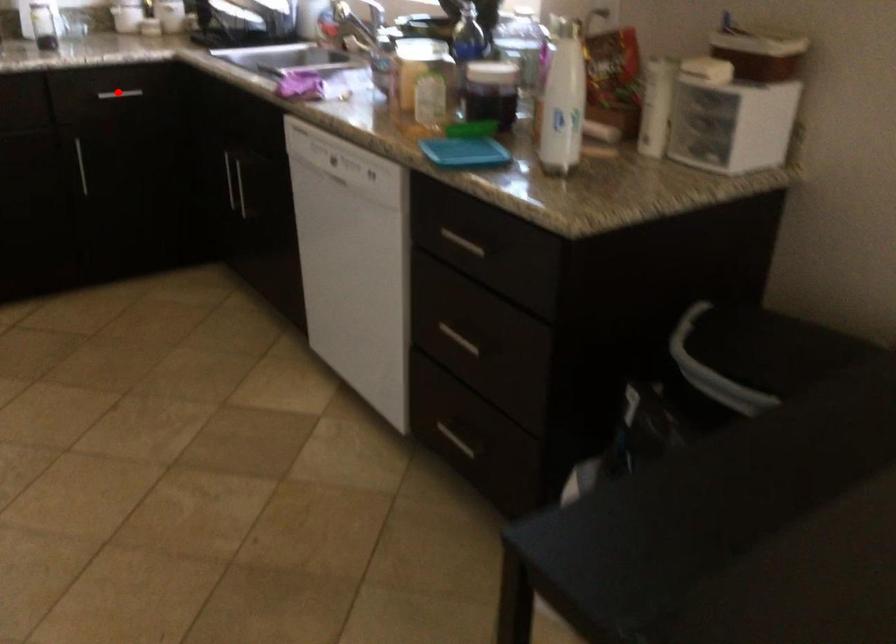
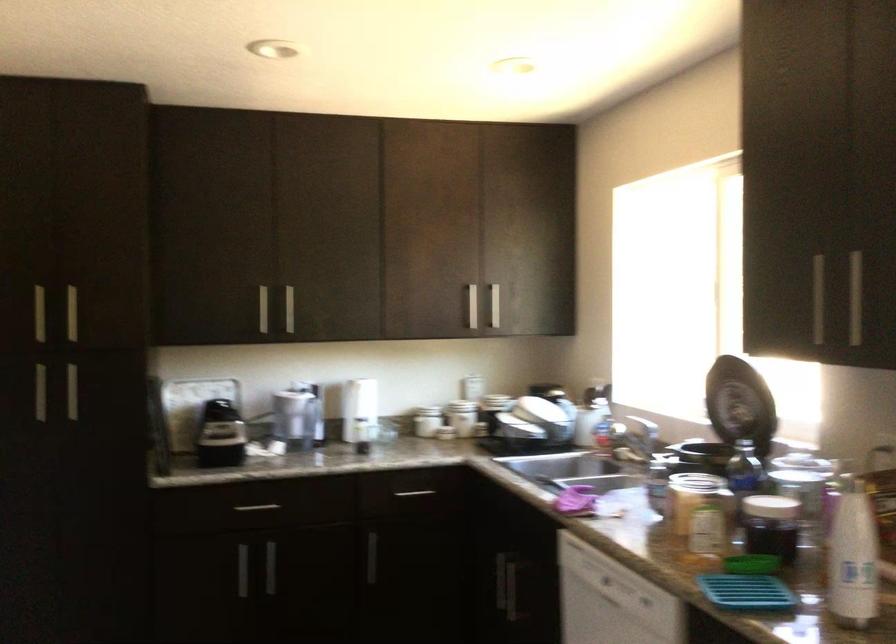
Question: I am providing you with two images of the same scene from different viewpoints. A red point is shown in image1. For the corresponding object point in image2, is it positioned nearer or farther from the camera?

Choices:
 (A) Nearer
 (B) Farther

Answer: (B)